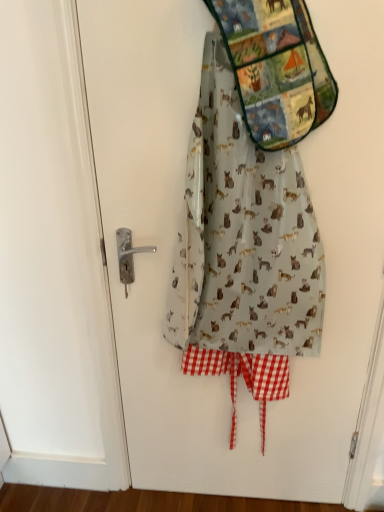
This screenshot has width=384, height=512. Describe the element at coordinates (276, 68) in the screenshot. I see `textured fabric pouch at upper right` at that location.

Measure the distance between point (295, 36) and camera.

Point (295, 36) and camera are 88.10 centimeters apart from each other.

This screenshot has width=384, height=512. Find the location of `textured fabric pouch at upper right`. textured fabric pouch at upper right is located at coordinates (276, 68).

This screenshot has width=384, height=512. In order to click on textured fabric pouch at upper right in this screenshot , I will do `click(276, 68)`.